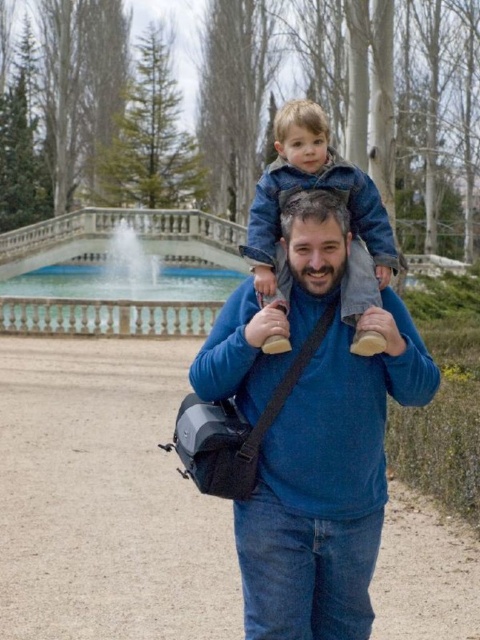
Is white marble fountain at center smaller than blue denim jacket at upper center?

Incorrect, white marble fountain at center is not smaller in size than blue denim jacket at upper center.

Can you confirm if white marble fountain at center is positioned to the left of blue denim jacket at upper center?

Yes, white marble fountain at center is to the left of blue denim jacket at upper center.

Does point (96, 246) lie behind point (356, 202)?

Yes.

Locate an element on the screen. This screenshot has width=480, height=640. white marble fountain at center is located at coordinates (113, 234).

I want to click on blue cotton sweater at center, so click(x=327, y=484).

Looking at this image, between blue cotton sweater at center and white marble fountain at center, which one has less height?

Standing shorter between the two is blue cotton sweater at center.

Where is `blue cotton sweater at center`? The width and height of the screenshot is (480, 640). blue cotton sweater at center is located at coordinates (327, 484).

The image size is (480, 640). What are the coordinates of `blue cotton sweater at center` in the screenshot? It's located at (327, 484).

Which is above, blue cotton sweater at center or blue denim jacket at upper center?

blue denim jacket at upper center

I want to click on blue cotton sweater at center, so click(327, 484).

In order to click on blue cotton sweater at center in this screenshot , I will do `click(327, 484)`.